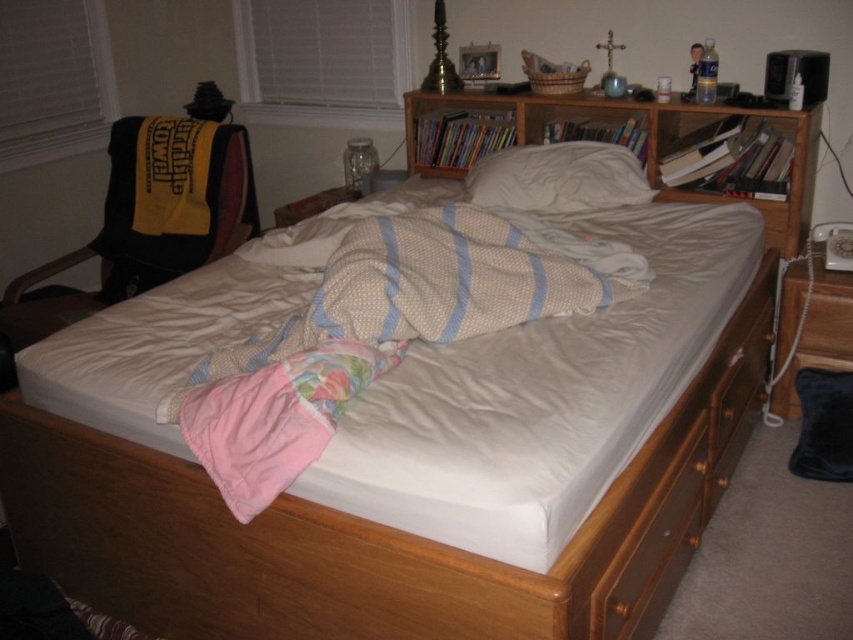
Is wooden drawer at lower right to the right of white soft pillow at center from the viewer's perspective?

Correct, you'll find wooden drawer at lower right to the right of white soft pillow at center.

In the scene shown: Who is more forward, (614, 582) or (490, 170)?

Point (614, 582) is in front.

Does point (698, 440) come closer to viewer compared to point (502, 177)?

Yes, it is in front of point (502, 177).

Locate an element on the screen. This screenshot has height=640, width=853. wooden drawer at lower right is located at coordinates (672, 484).

Is wooden drawer at lower right to the left of wooden bookshelf at center from the viewer's perspective?

No, wooden drawer at lower right is not to the left of wooden bookshelf at center.

Between wooden drawer at lower right and wooden bookshelf at center, which one appears on the left side from the viewer's perspective?

Positioned to the left is wooden bookshelf at center.

Does point (683, 461) lie behind point (700, 109)?

No.

In order to click on wooden drawer at lower right in this screenshot , I will do `click(672, 484)`.

Which is behind, point (547, 116) or point (606, 156)?

The point (547, 116) is more distant.

Between wooden bookshelf at center and white soft pillow at center, which one is positioned lower?

wooden bookshelf at center is lower down.

Who is more forward, (x=772, y=232) or (x=579, y=182)?

Point (x=772, y=232)

The width and height of the screenshot is (853, 640). I want to click on wooden bookshelf at center, so click(646, 144).